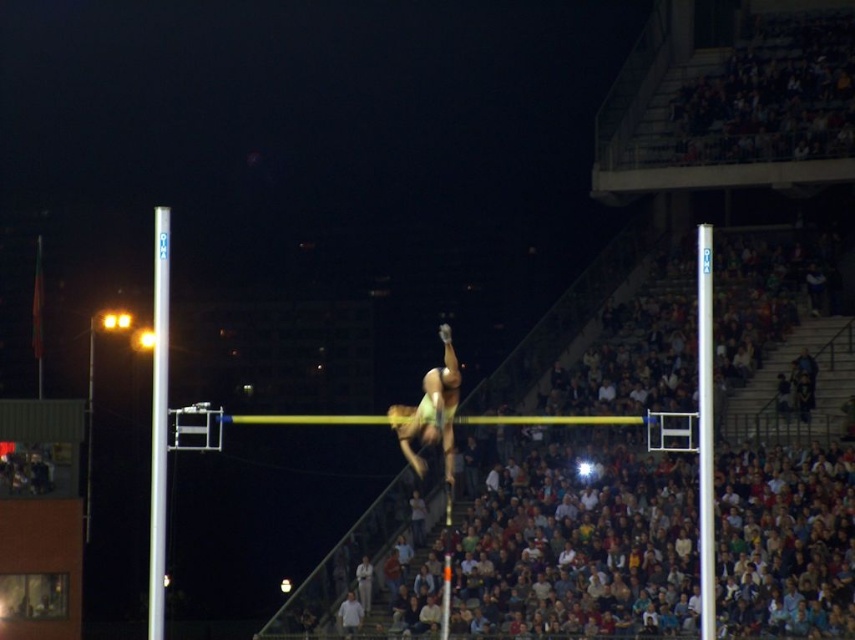
Between silver metallic pole at center and green fabric athlete at center, which one is positioned lower?

Positioned lower is green fabric athlete at center.

Describe the element at coordinates (705, 433) in the screenshot. I see `silver metallic pole at center` at that location.

Find the location of `silver metallic pole at center`. silver metallic pole at center is located at coordinates (705, 433).

Identify the location of silver metallic pole at center. (705, 433).

Who is positioned more to the right, silver metallic pole at left or green fabric athlete at center?

green fabric athlete at center is more to the right.

Is point (163, 561) farther from viewer compared to point (438, 371)?

Yes, point (163, 561) is farther from viewer.

Where is `silver metallic pole at left`? silver metallic pole at left is located at coordinates (158, 424).

Is point (152, 280) more distant than point (705, 456)?

Yes, point (152, 280) is behind point (705, 456).

Is point (158, 444) farther from camera compared to point (703, 472)?

Yes, point (158, 444) is behind point (703, 472).

Where is `silver metallic pole at left`? silver metallic pole at left is located at coordinates (158, 424).